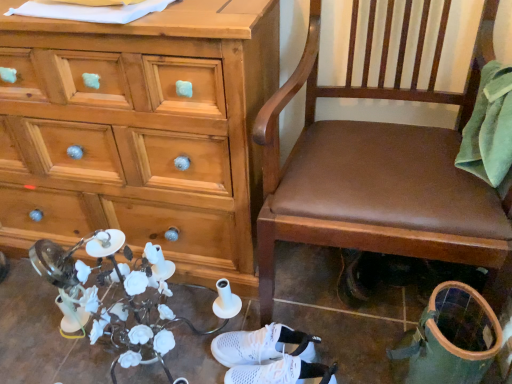
Question: Are wooden chest of drawers at left and brown leather chair at center located far from each other?

Choices:
 (A) yes
 (B) no

Answer: (B)

Question: Is wooden chest of drawers at left at the right side of brown leather chair at center?

Choices:
 (A) yes
 (B) no

Answer: (B)

Question: From a real-world perspective, is wooden chest of drawers at left below brown leather chair at center?

Choices:
 (A) yes
 (B) no

Answer: (A)

Question: Considering the relative sizes of wooden chest of drawers at left and brown leather chair at center in the image provided, is wooden chest of drawers at left taller than brown leather chair at center?

Choices:
 (A) yes
 (B) no

Answer: (B)

Question: Is wooden chest of drawers at left oriented away from brown leather chair at center?

Choices:
 (A) no
 (B) yes

Answer: (A)

Question: From the image's perspective, is brown leather chair at center above or below wooden chest of drawers at left?

Choices:
 (A) above
 (B) below

Answer: (B)

Question: Relative to wooden chest of drawers at left, is brown leather chair at center in front or behind?

Choices:
 (A) behind
 (B) front

Answer: (B)

Question: Is brown leather chair at center bigger or smaller than wooden chest of drawers at left?

Choices:
 (A) small
 (B) big

Answer: (A)

Question: From their relative heights in the image, would you say brown leather chair at center is taller or shorter than wooden chest of drawers at left?

Choices:
 (A) tall
 (B) short

Answer: (A)

Question: From a real-world perspective, is wooden chest of drawers at left above or below brown leather chair at center?

Choices:
 (A) below
 (B) above

Answer: (A)

Question: Looking at their shapes, would you say wooden chest of drawers at left is wider or thinner than brown leather chair at center?

Choices:
 (A) thin
 (B) wide

Answer: (A)

Question: Relative to brown leather chair at center, is wooden chest of drawers at left in front or behind?

Choices:
 (A) front
 (B) behind

Answer: (B)

Question: Would you say wooden chest of drawers at left is to the left or to the right of brown leather chair at center in the picture?

Choices:
 (A) right
 (B) left

Answer: (B)

Question: Considering the relative positions of white mesh sneakers at lower center, marked as the 1th footwear in a front-to-back arrangement, and white mesh sneakers at center, the second footwear positioned from the front, in the image provided, is white mesh sneakers at lower center, marked as the 1th footwear in a front-to-back arrangement, to the left or to the right of white mesh sneakers at center, the second footwear positioned from the front,?

Choices:
 (A) right
 (B) left

Answer: (A)

Question: From a real-world perspective, relative to white mesh sneakers at center, the second footwear positioned from the front, is white mesh sneakers at lower center, the 2th footwear in the back-to-front sequence, vertically above or below?

Choices:
 (A) below
 (B) above

Answer: (B)